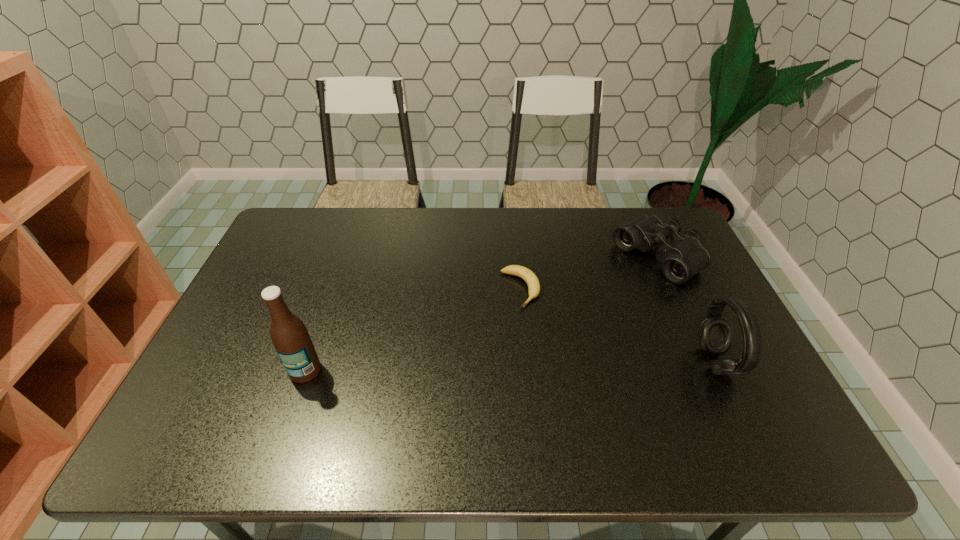
Identify the location of vacant area that lies between the leftmost object and the headset. Image resolution: width=960 pixels, height=540 pixels. (511, 366).

Where is `free spot between the beer bottle and the headset`? Image resolution: width=960 pixels, height=540 pixels. free spot between the beer bottle and the headset is located at coordinates (511, 366).

You are a GUI agent. You are given a task and a screenshot of the screen. Output one action in this format:
    pyautogui.click(x=<x>, y=<y>)
    Task: Click on the vacant area that lies between the headset and the leftmost object
    This screenshot has height=540, width=960.
    Given the screenshot: What is the action you would take?
    pyautogui.click(x=511, y=366)

Find the location of a particular element. vacant point located between the tallest object and the banana is located at coordinates (413, 330).

At what (x,y) coordinates should I click in order to perform the action: click on empty space between the binoculars and the tallest object. Please return your answer as a coordinate pair (x, y). The image size is (960, 540). Looking at the image, I should click on (481, 314).

Image resolution: width=960 pixels, height=540 pixels. Find the location of `free spot between the second shortest object and the headset`. free spot between the second shortest object and the headset is located at coordinates (686, 310).

The width and height of the screenshot is (960, 540). Identify the location of free space that is in between the second object from left to right and the third shortest object. (618, 326).

Identify the location of object that can be found as the second closest to the second object from left to right. (715, 333).

Identify which object is located as the nearest to the tallest object. Please provide its 2D coordinates. Your answer should be formatted as a tuple, i.e. [(x, y)], where the tuple contains the x and y coordinates of a point satisfying the conditions above.

[(527, 275)]

At what (x,y) coordinates should I click in order to perform the action: click on vacant space that satisfies the following two spatial constraints: 1. on the front side of the second shortest object; 2. on the earcups of the headset. Please return your answer as a coordinate pair (x, y). Looking at the image, I should click on (704, 362).